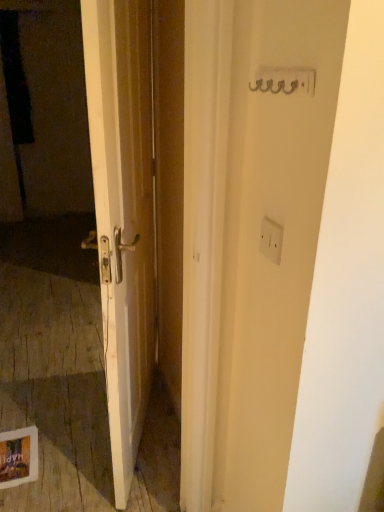
This screenshot has height=512, width=384. What do you see at coordinates (46, 140) in the screenshot?
I see `transparent plastic screen door at left` at bounding box center [46, 140].

Looking at this image, what is the approximate width of transparent plastic screen door at left?

transparent plastic screen door at left is 2.42 inches wide.

Find the location of a particular element. The height and width of the screenshot is (512, 384). transparent plastic screen door at left is located at coordinates (46, 140).

Identify the location of white plastic electric outlet at upper right. (271, 240).

Describe the element at coordinates (271, 240) in the screenshot. I see `white plastic electric outlet at upper right` at that location.

What is the approximate width of white plastic electric outlet at upper right?

white plastic electric outlet at upper right is 0.49 inches in width.

Measure the distance between white plastic electric outlet at upper right and camera.

white plastic electric outlet at upper right and camera are 34.37 inches apart from each other.

At what (x,y) coordinates should I click in order to perform the action: click on transparent plastic screen door at left. Please return your answer as a coordinate pair (x, y). The height and width of the screenshot is (512, 384). Looking at the image, I should click on (46, 140).

Considering the positions of objects white plastic electric outlet at upper right and transparent plastic screen door at left in the image provided, who is more to the left, white plastic electric outlet at upper right or transparent plastic screen door at left?

Positioned to the left is transparent plastic screen door at left.

Is white plastic electric outlet at upper right positioned in front of transparent plastic screen door at left?

Yes.

Does point (281, 245) appear closer or farther from the camera than point (59, 22)?

Point (281, 245).

From the image's perspective, relative to transparent plastic screen door at left, is white plastic electric outlet at upper right above or below?

white plastic electric outlet at upper right is situated lower than transparent plastic screen door at left in the image.

From a real-world perspective, is white plastic electric outlet at upper right physically above transparent plastic screen door at left?

Yes, from a real-world perspective, white plastic electric outlet at upper right is above transparent plastic screen door at left.

Does white plastic electric outlet at upper right have a greater width compared to transparent plastic screen door at left?

No.

Considering the sizes of objects white plastic electric outlet at upper right and transparent plastic screen door at left in the image provided, who is taller, white plastic electric outlet at upper right or transparent plastic screen door at left?

With more height is transparent plastic screen door at left.

Which of these two, white plastic electric outlet at upper right or transparent plastic screen door at left, is bigger?

transparent plastic screen door at left is bigger.

Would you say white plastic electric outlet at upper right is inside or outside transparent plastic screen door at left?

white plastic electric outlet at upper right is located beyond the bounds of transparent plastic screen door at left.

Is white plastic electric outlet at upper right next to transparent plastic screen door at left and touching it?

There is a gap between white plastic electric outlet at upper right and transparent plastic screen door at left.

Could you tell me if white plastic electric outlet at upper right is turned towards transparent plastic screen door at left?

No, white plastic electric outlet at upper right does not turn towards transparent plastic screen door at left.

You are a GUI agent. You are given a task and a screenshot of the screen. Output one action in this format:
    pyautogui.click(x=<x>, y=<y>)
    Task: Click on the electric outlet in front of the transparent plastic screen door at left
    This screenshot has height=512, width=384.
    Given the screenshot: What is the action you would take?
    pyautogui.click(x=271, y=240)

In the scene shown: Considering the relative positions of transparent plastic screen door at left and white plastic electric outlet at upper right in the image provided, is transparent plastic screen door at left to the right of white plastic electric outlet at upper right from the viewer's perspective?

In fact, transparent plastic screen door at left is to the left of white plastic electric outlet at upper right.

Which object is more forward, transparent plastic screen door at left or white plastic electric outlet at upper right?

white plastic electric outlet at upper right is more forward.

Is point (49, 207) closer or farther from the camera than point (270, 245)?

Point (49, 207).

From the image's perspective, is transparent plastic screen door at left above or below white plastic electric outlet at upper right?

Clearly, from the image's perspective, transparent plastic screen door at left is above white plastic electric outlet at upper right.

From a real-world perspective, is transparent plastic screen door at left on white plastic electric outlet at upper right?

No, from a real-world perspective, transparent plastic screen door at left is not on top of white plastic electric outlet at upper right.

Is transparent plastic screen door at left wider than white plastic electric outlet at upper right?

Yes, transparent plastic screen door at left is wider than white plastic electric outlet at upper right.

In terms of height, does transparent plastic screen door at left look taller or shorter compared to white plastic electric outlet at upper right?

transparent plastic screen door at left is taller than white plastic electric outlet at upper right.

Is transparent plastic screen door at left bigger or smaller than white plastic electric outlet at upper right?

Considering their sizes, transparent plastic screen door at left takes up more space than white plastic electric outlet at upper right.

Is transparent plastic screen door at left surrounding white plastic electric outlet at upper right?

Actually, white plastic electric outlet at upper right is outside transparent plastic screen door at left.

Is transparent plastic screen door at left far from white plastic electric outlet at upper right?

Yes, transparent plastic screen door at left is far from white plastic electric outlet at upper right.

Consider the image. Is transparent plastic screen door at left facing towards white plastic electric outlet at upper right?

Yes.

How different are the orientations of transparent plastic screen door at left and white plastic electric outlet at upper right in degrees?

There is a 90.1-degree angle between the facing directions of transparent plastic screen door at left and white plastic electric outlet at upper right.

How distant is transparent plastic screen door at left from white plastic electric outlet at upper right?

transparent plastic screen door at left and white plastic electric outlet at upper right are 3.67 meters apart.

At what (x,y) coordinates should I click in order to perform the action: click on screen door that is under the white plastic electric outlet at upper right (from a real-world perspective). Please return your answer as a coordinate pair (x, y). Looking at the image, I should click on (46, 140).

This screenshot has width=384, height=512. I want to click on screen door above the white plastic electric outlet at upper right (from the image's perspective), so click(x=46, y=140).

Locate an element on the screen. electric outlet below the transparent plastic screen door at left (from the image's perspective) is located at coordinates [271, 240].